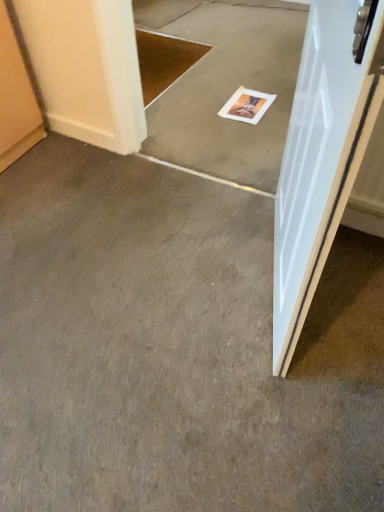
Question: Is white glossy door at right to the left of white paper magazine at center from the viewer's perspective?

Choices:
 (A) yes
 (B) no

Answer: (B)

Question: Can you confirm if white glossy door at right is shorter than white paper magazine at center?

Choices:
 (A) yes
 (B) no

Answer: (B)

Question: From the image's perspective, is white glossy door at right located above white paper magazine at center?

Choices:
 (A) yes
 (B) no

Answer: (B)

Question: Can you confirm if white glossy door at right is wider than white paper magazine at center?

Choices:
 (A) no
 (B) yes

Answer: (A)

Question: From a real-world perspective, is white glossy door at right positioned under white paper magazine at center based on gravity?

Choices:
 (A) yes
 (B) no

Answer: (B)

Question: Looking at the image, does smooth gray carpet at center, placed as the second concrete when sorted from bottom to top, seem bigger or smaller compared to gray carpet at center, placed as the 2th concrete when sorted from top to bottom?

Choices:
 (A) small
 (B) big

Answer: (B)

Question: Considering their positions, is smooth gray carpet at center, the 1th concrete in the top-to-bottom sequence, located in front of or behind gray carpet at center, the first concrete in the bottom-to-top sequence?

Choices:
 (A) behind
 (B) front

Answer: (A)

Question: In terms of width, does smooth gray carpet at center, placed as the second concrete when sorted from bottom to top, look wider or thinner when compared to gray carpet at center, the first concrete in the bottom-to-top sequence?

Choices:
 (A) thin
 (B) wide

Answer: (A)

Question: Considering the positions of smooth gray carpet at center, placed as the second concrete when sorted from bottom to top, and gray carpet at center, the first concrete in the bottom-to-top sequence, in the image, is smooth gray carpet at center, placed as the second concrete when sorted from bottom to top, taller or shorter than gray carpet at center, the first concrete in the bottom-to-top sequence,?

Choices:
 (A) tall
 (B) short

Answer: (A)

Question: Is point (173, 84) positioned closer to the camera than point (372, 110)?

Choices:
 (A) closer
 (B) farther

Answer: (B)

Question: In terms of width, does smooth gray carpet at center, the 1th concrete in the top-to-bottom sequence, look wider or thinner when compared to white glossy door at right?

Choices:
 (A) wide
 (B) thin

Answer: (A)

Question: Considering their positions, is smooth gray carpet at center, the 1th concrete in the top-to-bottom sequence, located in front of or behind white glossy door at right?

Choices:
 (A) front
 (B) behind

Answer: (B)

Question: Would you say smooth gray carpet at center, the 1th concrete in the top-to-bottom sequence, is to the left or to the right of white glossy door at right in the picture?

Choices:
 (A) right
 (B) left

Answer: (B)

Question: Considering the positions of white paper magazine at center and gray carpet at center, the first concrete in the bottom-to-top sequence, in the image, is white paper magazine at center taller or shorter than gray carpet at center, the first concrete in the bottom-to-top sequence,?

Choices:
 (A) tall
 (B) short

Answer: (B)

Question: From the image's perspective, is white paper magazine at center above or below gray carpet at center, placed as the 2th concrete when sorted from top to bottom?

Choices:
 (A) above
 (B) below

Answer: (A)